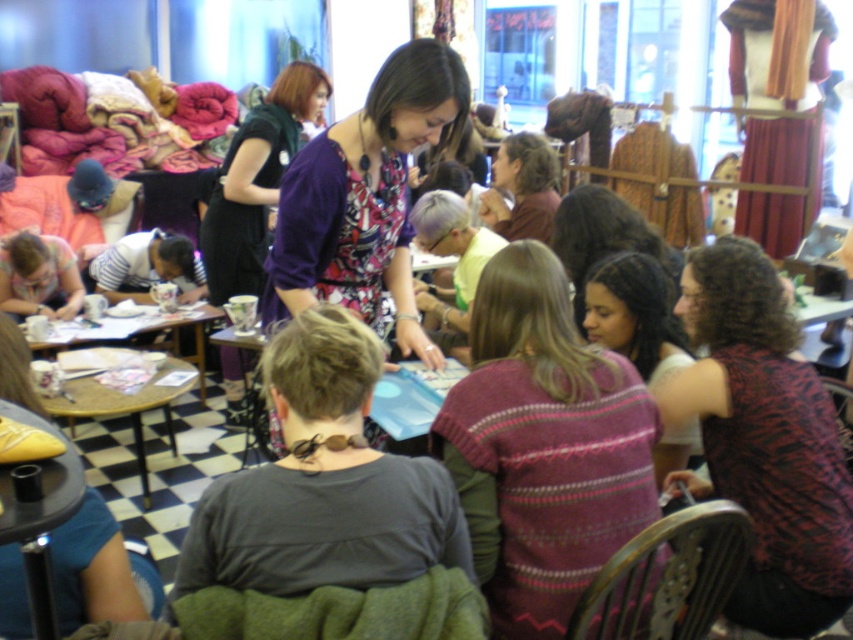
Does dark brown hair at center appear on the right side of matte pink sweater at lower left?

Correct, you'll find dark brown hair at center to the right of matte pink sweater at lower left.

Is point (672, 317) farther from camera compared to point (9, 294)?

No, (672, 317) is closer to viewer.

At what (x,y) coordinates should I click in order to perform the action: click on dark brown hair at center. Please return your answer as a coordinate pair (x, y). The height and width of the screenshot is (640, 853). Looking at the image, I should click on (604, 237).

From the picture: Can you confirm if printed fabric dress at center is positioned to the right of wooden table at lower left?

Correct, you'll find printed fabric dress at center to the right of wooden table at lower left.

Is printed fabric dress at center closer to camera compared to wooden table at lower left?

That is True.

Does point (399, 276) lie in front of point (86, 410)?

Yes, it is.

The height and width of the screenshot is (640, 853). In order to click on printed fabric dress at center in this screenshot , I will do `click(364, 196)`.

Is striped sweater at center thinner than wooden table at lower left?

Correct, striped sweater at center's width is less than wooden table at lower left's.

Who is more distant from viewer, (676, 349) or (68, 394)?

Point (68, 394)

This screenshot has width=853, height=640. In order to click on striped sweater at center in this screenshot , I will do `click(634, 314)`.